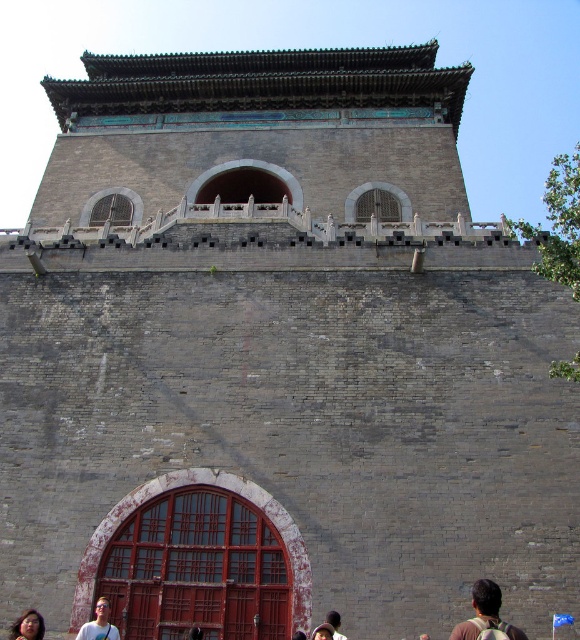
Question: Which object is closer to the camera taking this photo?

Choices:
 (A) matte blue shirt at lower center
 (B) smooth skin face at lower left
 (C) brown backpack at lower center
 (D) brown leather backpack at lower center

Answer: (C)

Question: Among these objects, which one is nearest to the camera?

Choices:
 (A) matte blue shirt at lower center
 (B) brown leather backpack at lower center
 (C) brown backpack at lower center

Answer: (C)

Question: Is brown backpack at lower center wider than matte blue shirt at lower center?

Choices:
 (A) no
 (B) yes

Answer: (B)

Question: Which of the following is the closest to the observer?

Choices:
 (A) brown backpack at lower center
 (B) brown leather hat at lower center
 (C) matte blue shirt at lower center

Answer: (A)

Question: Is matte blue shirt at lower center above brown leather hat at lower center?

Choices:
 (A) no
 (B) yes

Answer: (A)

Question: Can you confirm if brown backpack at lower center is positioned to the right of smooth skin face at lower left?

Choices:
 (A) yes
 (B) no

Answer: (A)